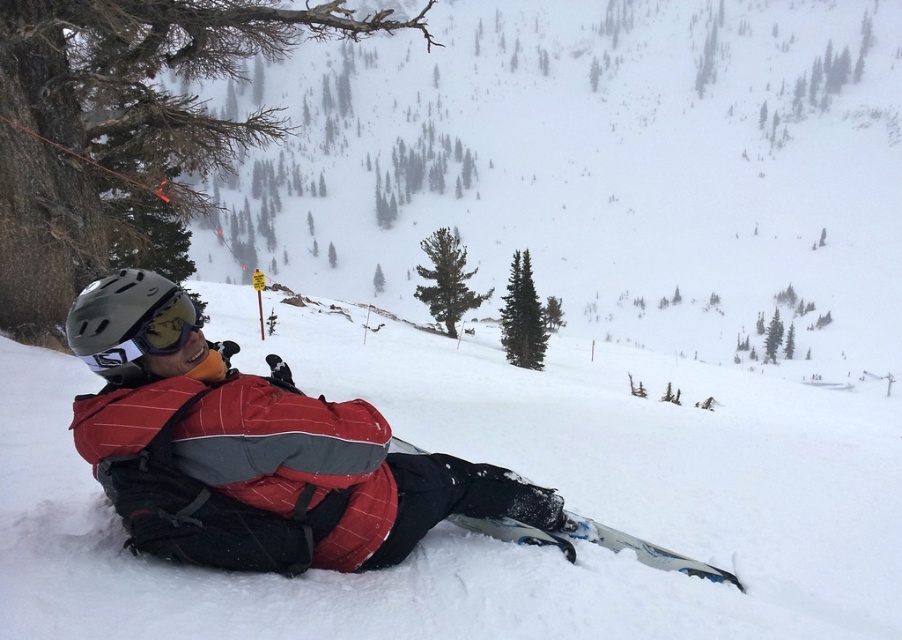
Measure the distance between matte gray helmet at left and blue metallic ski at lower right.

matte gray helmet at left and blue metallic ski at lower right are 3.15 meters apart from each other.

Does matte gray helmet at left have a smaller size compared to blue metallic ski at lower right?

Yes, matte gray helmet at left is smaller than blue metallic ski at lower right.

This screenshot has width=902, height=640. What are the coordinates of `matte gray helmet at left` in the screenshot? It's located at (129, 323).

This screenshot has width=902, height=640. Describe the element at coordinates (291, 440) in the screenshot. I see `red matte jacket at center` at that location.

Is red matte jacket at center thinner than blue metallic ski at lower right?

Incorrect, red matte jacket at center's width is not less than blue metallic ski at lower right's.

Which is behind, point (359, 424) or point (723, 572)?

Point (723, 572)

Where is `red matte jacket at center`? red matte jacket at center is located at coordinates (291, 440).

Who is positioned more to the left, red matte jacket at center or matte gray helmet at left?

Positioned to the left is matte gray helmet at left.

Does red matte jacket at center appear on the right side of matte gray helmet at left?

Indeed, red matte jacket at center is positioned on the right side of matte gray helmet at left.

The height and width of the screenshot is (640, 902). What are the coordinates of `red matte jacket at center` in the screenshot? It's located at (291, 440).

Locate an element on the screen. red matte jacket at center is located at coordinates (291, 440).